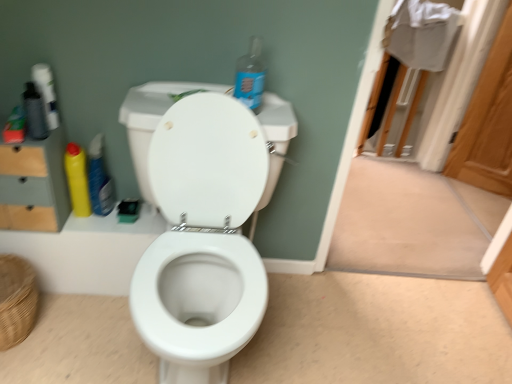
Find the location of a particular element. Image resolution: width=512 pixels, height=384 pixels. vacant space to the right of woven brown basket at lower left is located at coordinates (76, 333).